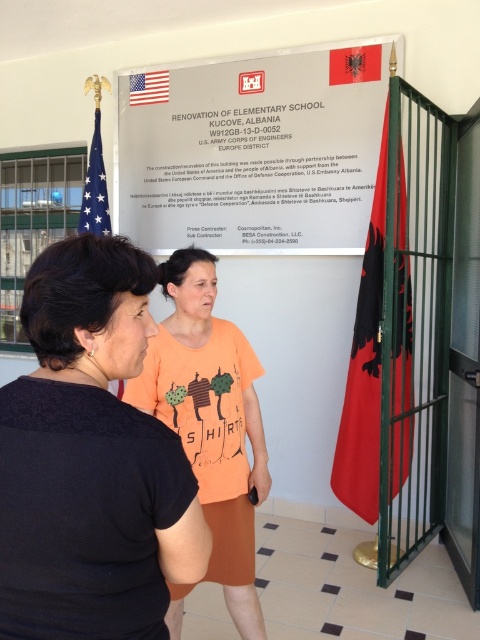
Is point (404, 193) farther from camera compared to point (99, 193)?

No.

Describe the element at coordinates (364, 368) in the screenshot. The image size is (480, 640). I see `red fabric flag at right` at that location.

Locate an element on the screen. This screenshot has width=480, height=640. red fabric flag at right is located at coordinates (364, 368).

This screenshot has height=640, width=480. What are the coordinates of `red fabric flag at right` in the screenshot? It's located at (364, 368).

Is white paper at center above blue fabric flag at upper left?

Indeed, white paper at center is positioned over blue fabric flag at upper left.

Between white paper at center and blue fabric flag at upper left, which one appears on the right side from the viewer's perspective?

From the viewer's perspective, white paper at center appears more on the right side.

Between point (322, 54) and point (95, 202), which one is positioned in front?

Positioned in front is point (322, 54).

Where is `white paper at center`? white paper at center is located at coordinates (255, 154).

Does point (133, 573) lie behind point (365, 330)?

No, (133, 573) is closer to viewer.

Is point (12, 433) positioned before point (379, 356)?

Yes, it is.

Is point (70, 636) behind point (360, 381)?

That is False.

The image size is (480, 640). Find the location of `black matte shirt at center`. black matte shirt at center is located at coordinates (90, 460).